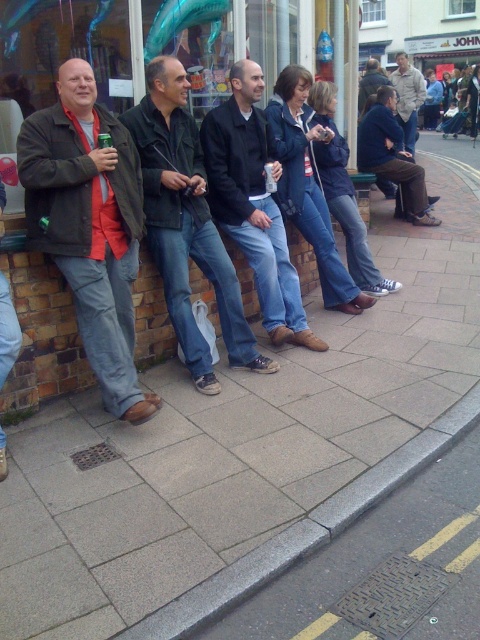
Based on the photo, is matte black jacket at left positioned behind dark green jacket at center?

No, matte black jacket at left is closer to the viewer.

Image resolution: width=480 pixels, height=640 pixels. In order to click on matte black jacket at left in this screenshot , I will do `click(90, 225)`.

Where is `matte black jacket at left`? This screenshot has width=480, height=640. matte black jacket at left is located at coordinates (90, 225).

Does dark green jacket at center have a greater width compared to dark brown leather jacket at center?

Indeed, dark green jacket at center has a greater width compared to dark brown leather jacket at center.

What do you see at coordinates (186, 224) in the screenshot? The height and width of the screenshot is (640, 480). I see `dark green jacket at center` at bounding box center [186, 224].

Which is in front, point (238, 308) or point (363, 99)?

Point (238, 308)

Where is `dark green jacket at center`? dark green jacket at center is located at coordinates (186, 224).

Which is behind, point (121, 314) or point (275, 216)?

The point (275, 216) is more distant.

Does matte black jacket at left have a greater height compared to dark brown leather shoes at center?

No.

Is point (88, 294) behind point (260, 280)?

No, it is not.

Image resolution: width=480 pixels, height=640 pixels. Find the location of `matte black jacket at left`. matte black jacket at left is located at coordinates (90, 225).